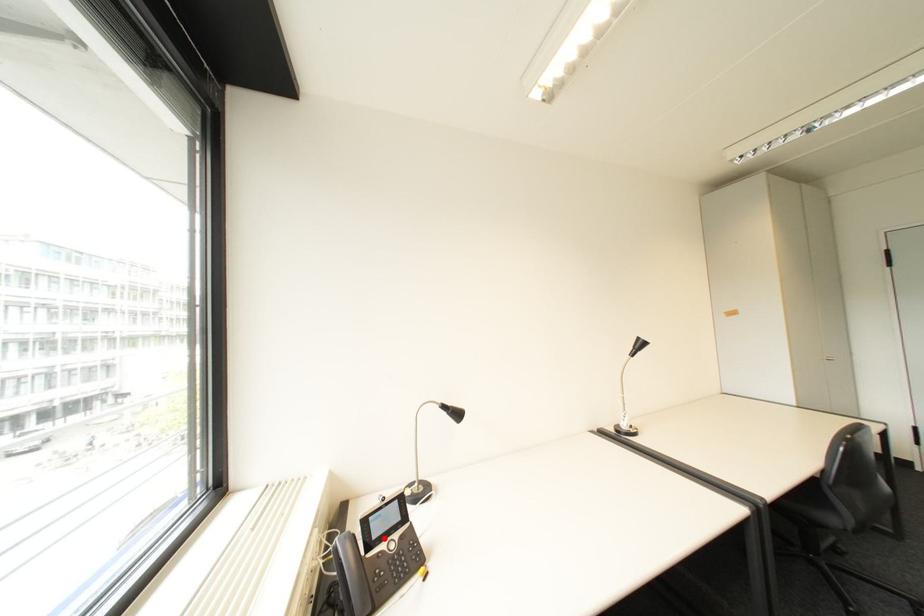
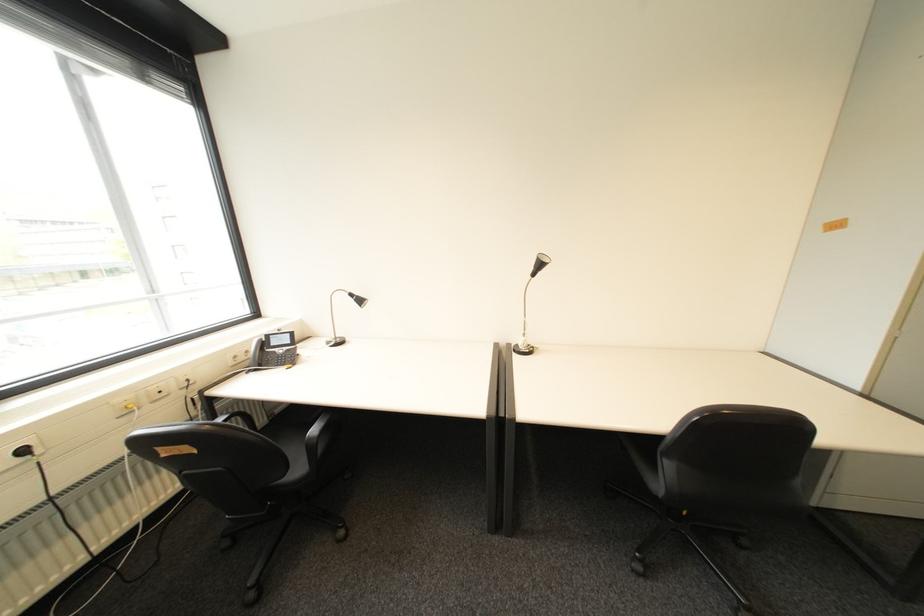
Where in the second image is the point corresponding to the highlighted location from the first image?

(283, 345)